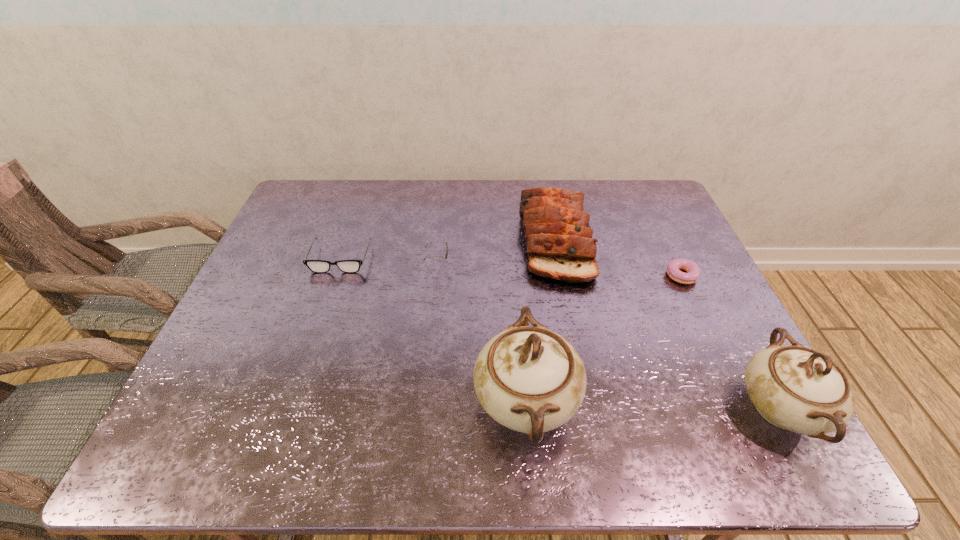
With all chinawares evenly spaced, where should an extra chinaware be placed on the left to continue the pattern? Please point out a vacant space. Please provide its 2D coordinates. Your answer should be formatted as a tuple, i.e. [(x, y)], where the tuple contains the x and y coordinates of a point satisfying the conditions above.

[(278, 396)]